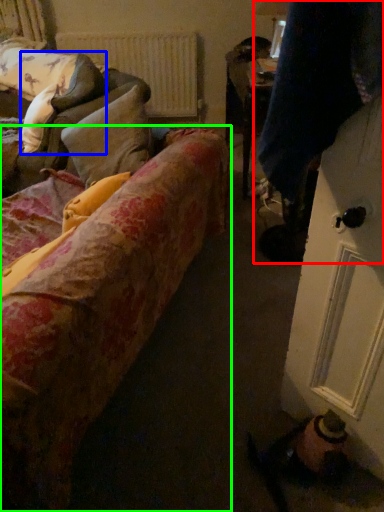
Question: Estimate the real-world distances between objects in this image. Which object is farther from couple (highlighted by a red box), pillow (highlighted by a blue box) or studio couch (highlighted by a green box)?

Choices:
 (A) pillow
 (B) studio couch

Answer: (A)